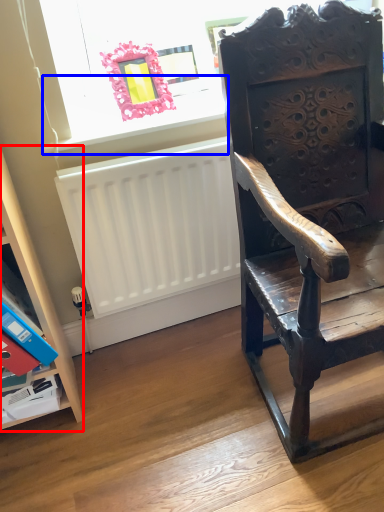
Question: Which object appears closest to the camera in this image, shelf (highlighted by a red box) or window sill (highlighted by a blue box)?

Choices:
 (A) shelf
 (B) window sill

Answer: (A)